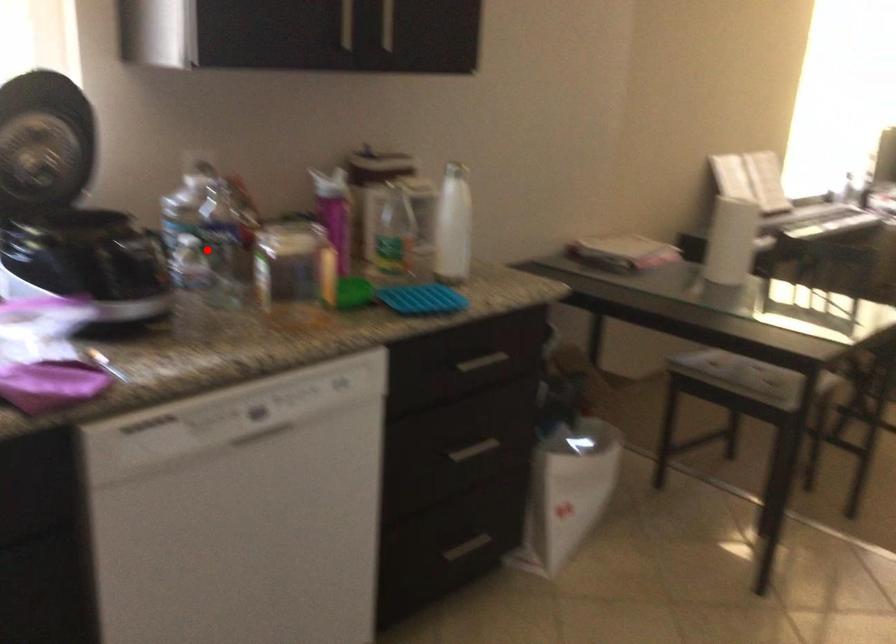
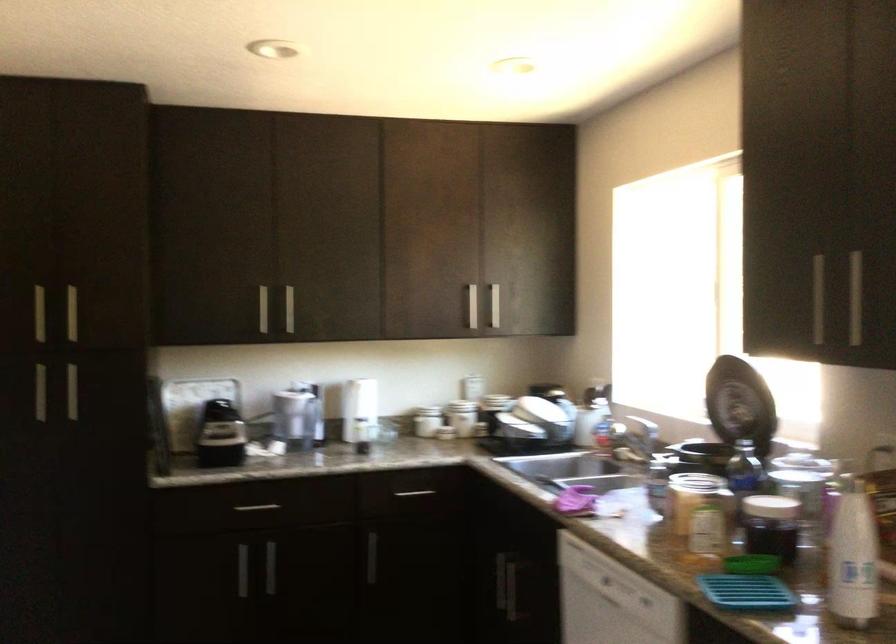
The point at the highlighted location is marked in the first image. Where is the corresponding point in the second image?

(771, 526)